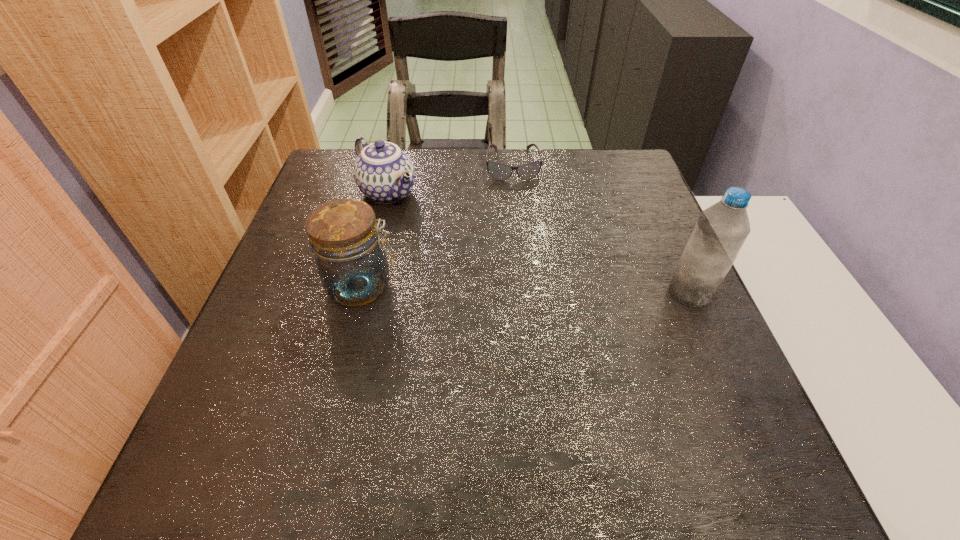
You are a GUI agent. You are given a task and a screenshot of the screen. Output one action in this format:
    pyautogui.click(x=<x>, y=<y>)
    Task: Click on the free space on the desktop that is between the jar and the water bottle and is positioned on the lenses of the second object from right to left
    This screenshot has height=540, width=960.
    Given the screenshot: What is the action you would take?
    pyautogui.click(x=527, y=289)

You are a GUI agent. You are given a task and a screenshot of the screen. Output one action in this format:
    pyautogui.click(x=<x>, y=<y>)
    Task: Click on the vacant spot on the desktop that is between the second tallest object and the tallest object and is positioned from the spout of the chinaware
    
    Given the screenshot: What is the action you would take?
    pyautogui.click(x=497, y=289)